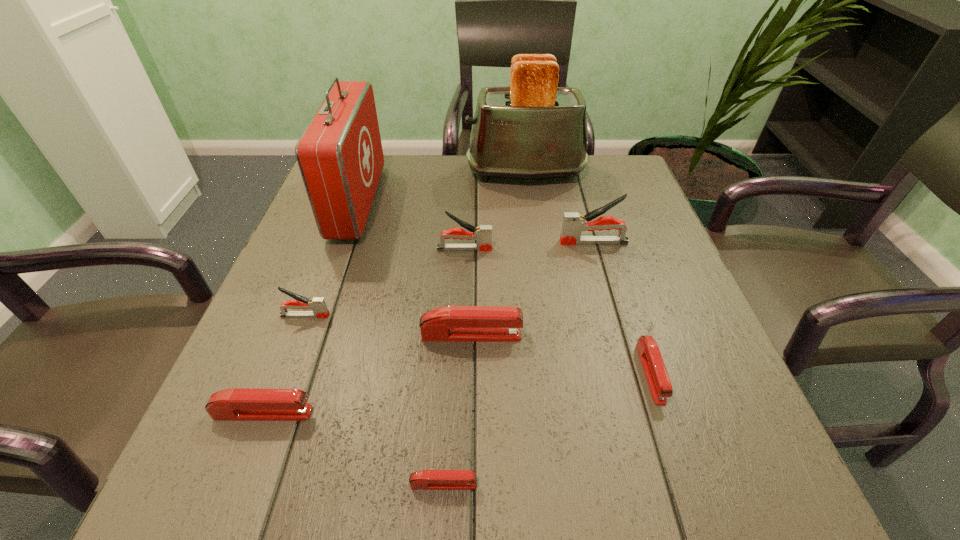
The height and width of the screenshot is (540, 960). In order to click on the first-aid kit positioned at the far edge in this screenshot , I will do `click(340, 156)`.

You are a GUI agent. You are given a task and a screenshot of the screen. Output one action in this format:
    pyautogui.click(x=<x>, y=<y>)
    Task: Click on the object located in the near edge section of the desktop
    This screenshot has width=960, height=540.
    Given the screenshot: What is the action you would take?
    pyautogui.click(x=426, y=479)

The height and width of the screenshot is (540, 960). In order to click on the first-aid kit that is at the left edge in this screenshot , I will do (x=340, y=156).

The width and height of the screenshot is (960, 540). I want to click on toaster at the right edge, so click(x=533, y=129).

Identify the location of object present at the far left corner. point(340,156).

Find the location of a particular element. Image resolution: width=960 pixels, height=540 pixels. object at the far right corner is located at coordinates [533, 129].

Where is `vacant space at the far edge of the desktop`? Image resolution: width=960 pixels, height=540 pixels. vacant space at the far edge of the desktop is located at coordinates (448, 179).

You are a GUI agent. You are given a task and a screenshot of the screen. Output one action in this format:
    pyautogui.click(x=<x>, y=<y>)
    Task: Click on the free region at the near edge
    This screenshot has height=540, width=960.
    Given the screenshot: What is the action you would take?
    pyautogui.click(x=345, y=497)

Find the location of a particular element. The image size is (960, 540). vacant area at the left edge of the desktop is located at coordinates (347, 292).

Find the location of a particular element. free space at the right edge of the desktop is located at coordinates (636, 332).